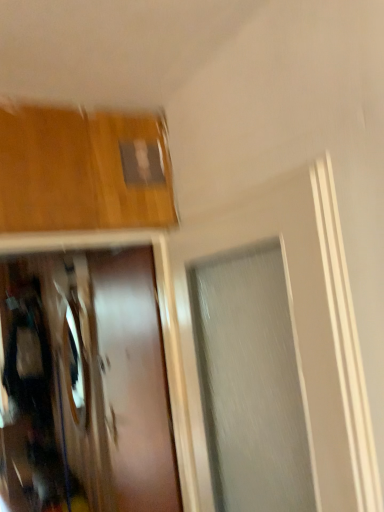
Question: Is satin brown door at center not near shiny silver mirror at left?

Choices:
 (A) yes
 (B) no

Answer: (B)

Question: Is satin brown door at center oriented towards shiny silver mirror at left?

Choices:
 (A) yes
 (B) no

Answer: (B)

Question: Can you confirm if satin brown door at center is taller than shiny silver mirror at left?

Choices:
 (A) no
 (B) yes

Answer: (B)

Question: Does satin brown door at center come in front of shiny silver mirror at left?

Choices:
 (A) yes
 (B) no

Answer: (A)

Question: Is satin brown door at center wider than shiny silver mirror at left?

Choices:
 (A) yes
 (B) no

Answer: (A)

Question: From a real-world perspective, is satin brown door at center on shiny silver mirror at left?

Choices:
 (A) yes
 (B) no

Answer: (B)

Question: From a real-world perspective, is shiny silver mirror at left located higher than satin brown door at center?

Choices:
 (A) yes
 (B) no

Answer: (A)

Question: From the image's perspective, is shiny silver mirror at left below satin brown door at center?

Choices:
 (A) yes
 (B) no

Answer: (A)

Question: Is shiny silver mirror at left closer to camera compared to satin brown door at center?

Choices:
 (A) yes
 (B) no

Answer: (B)

Question: Can you confirm if shiny silver mirror at left is taller than satin brown door at center?

Choices:
 (A) no
 (B) yes

Answer: (A)

Question: Is satin brown door at center located within shiny silver mirror at left?

Choices:
 (A) no
 (B) yes

Answer: (A)

Question: Does shiny silver mirror at left lie behind satin brown door at center?

Choices:
 (A) no
 (B) yes

Answer: (B)

Question: From the image's perspective, is satin brown door at center positioned above or below shiny silver mirror at left?

Choices:
 (A) below
 (B) above

Answer: (B)